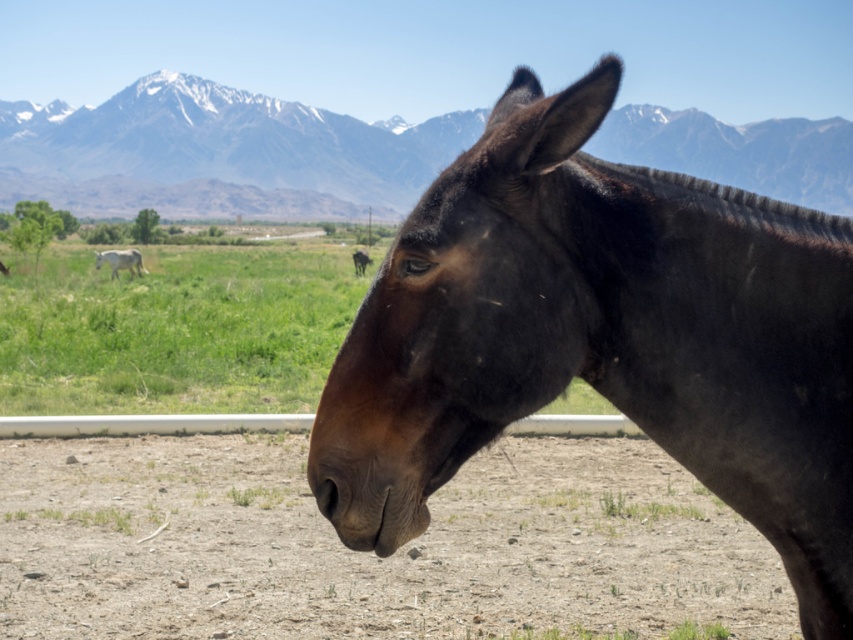
Question: Based on their relative distances, which object is nearer to the white glossy horse at left?

Choices:
 (A) brown matte donkey at center
 (B) green grass at center
 (C) snowy rock mountain at upper center
 (D) brown glossy horse at center

Answer: (A)

Question: Does brown glossy horse at center appear on the right side of brown dirt field at lower center?

Choices:
 (A) no
 (B) yes

Answer: (B)

Question: Which point is farther from the camera taking this photo?

Choices:
 (A) (213, 355)
 (B) (537, 209)
 (C) (262, 136)

Answer: (C)

Question: Which object is closer to the camera taking this photo?

Choices:
 (A) brown matte donkey at center
 (B) green grass at center
 (C) white glossy horse at left

Answer: (B)

Question: Can you confirm if brown dirt field at lower center is positioned above snowy rock mountain at upper center?

Choices:
 (A) no
 (B) yes

Answer: (A)

Question: Can you confirm if brown glossy horse at center is smaller than white glossy horse at left?

Choices:
 (A) no
 (B) yes

Answer: (B)